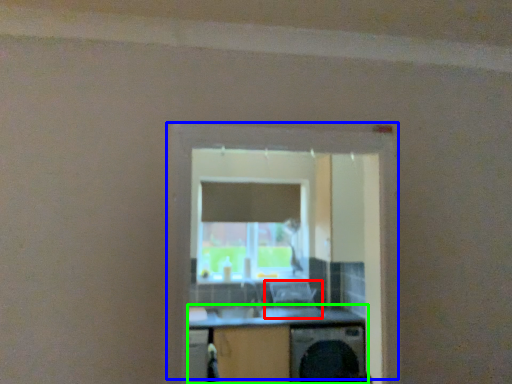
Question: Which is farther away from computer chair (highlighted by a red box)? window (highlighted by a blue box) or computer desk (highlighted by a green box)?

Choices:
 (A) window
 (B) computer desk

Answer: (A)